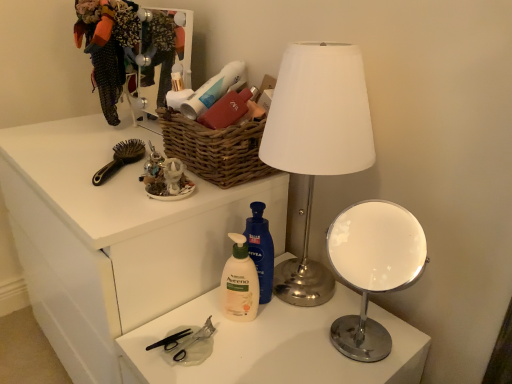
The image size is (512, 384). Identify the location of free space that is to the left of metallic silver mirror at upper center. pos(100,135).